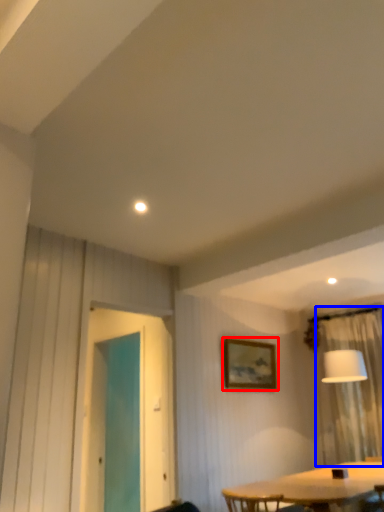
Question: Which object appears farthest to the camera in this image, picture frame (highlighted by a red box) or curtain (highlighted by a blue box)?

Choices:
 (A) picture frame
 (B) curtain

Answer: (A)